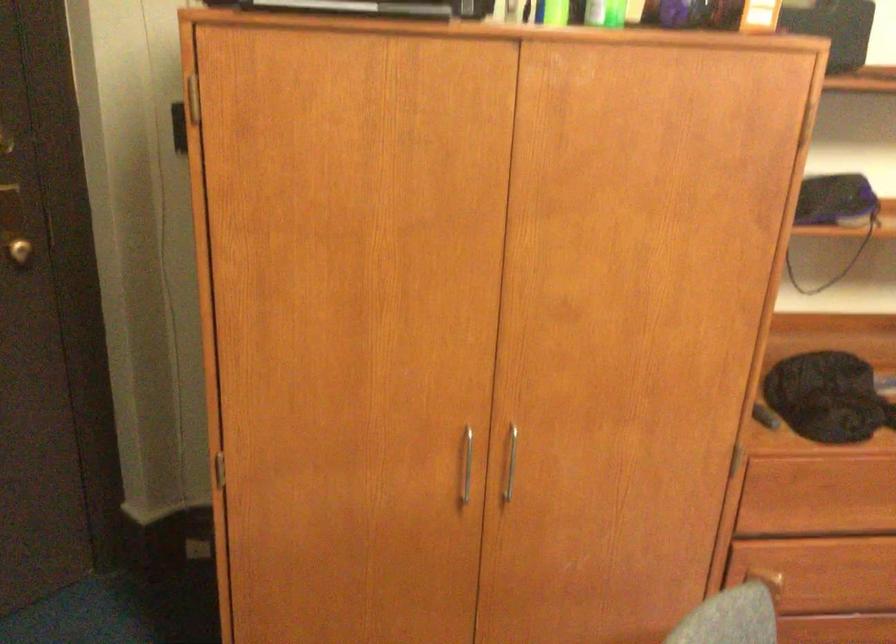
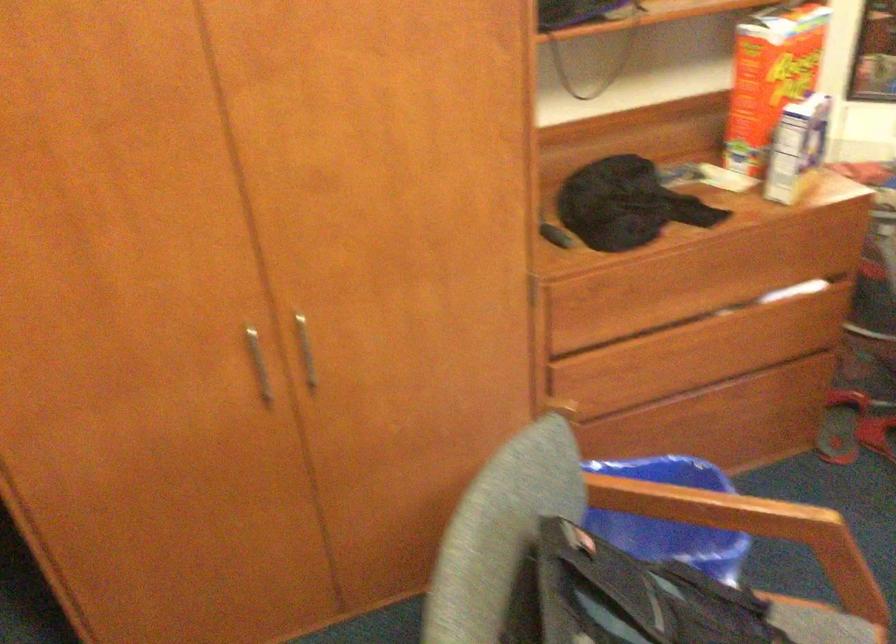
In a continuous first-person perspective shot, in which direction is the camera moving?

The cameraman moved toward right, forward.